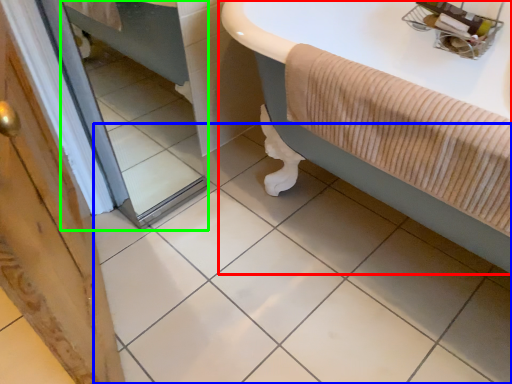
Question: Which object is the farthest from bathtub (highlighted by a red box)? Choose among these: ceramic tile (highlighted by a blue box) or mirror (highlighted by a green box).

Choices:
 (A) ceramic tile
 (B) mirror

Answer: (B)